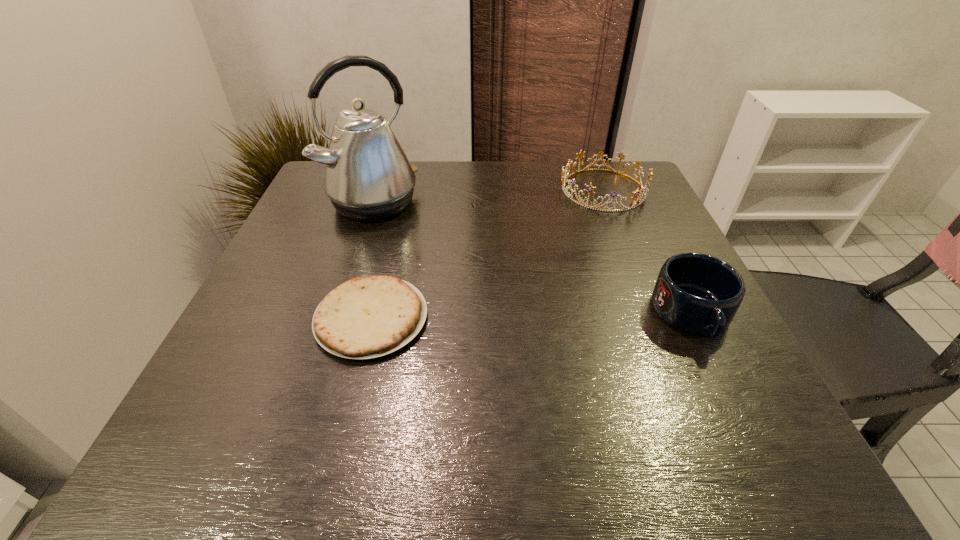
I want to click on vacant space on the desktop that is between the tortilla and the mug and is positioned on the front-facing side of the tiara, so click(495, 317).

Where is `vacant spot on the desktop that is between the shortest object and the mug and is positioned from the spout of the tallest object`? The height and width of the screenshot is (540, 960). vacant spot on the desktop that is between the shortest object and the mug and is positioned from the spout of the tallest object is located at coordinates (501, 316).